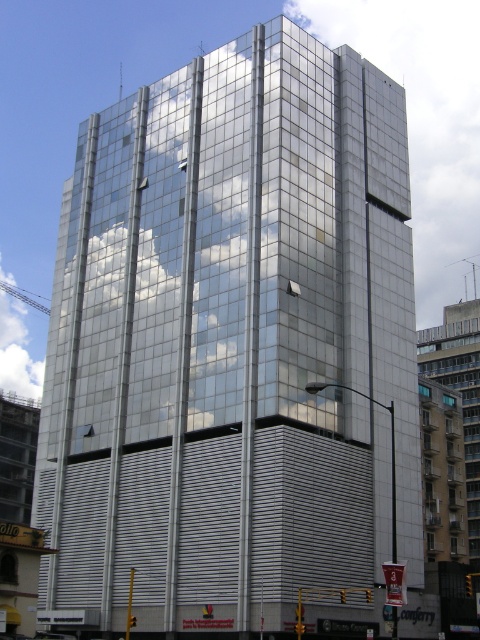
You are a drone operator planning to fly a drone between the transparent glass cloud at center and the white fluffy cloud at upper left. The drone has a maximum flight distance of 100 meters. Can the drone safely make this journey without running out of battery?

The distance between the transparent glass cloud at center and the white fluffy cloud at upper left is 121.81 meters, which exceeds the drone operator maximum flight distance of 100 meters. The drone cannot safely make this journey without running out of battery.

Looking at the modern building with its reflective glass facade, you notice two clouds in the scene. Which cloud has a greater width when comparing the transparent glass cloud at center and the white fluffy cloud at upper left?

The transparent glass cloud at center has a greater width than the white fluffy cloud at upper left according to the description.